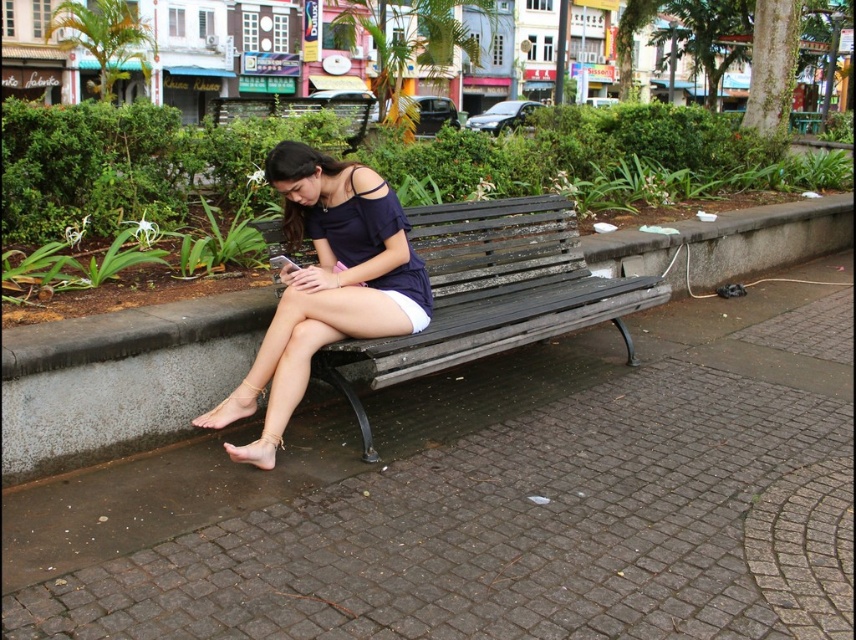
Question: Which point is closer to the camera taking this photo?

Choices:
 (A) (313, 269)
 (B) (522, 282)

Answer: (A)

Question: Is dark gray wooden bench at center behind matte blue dress at center?

Choices:
 (A) yes
 (B) no

Answer: (B)

Question: Is dark gray wooden bench at center positioned behind matte blue dress at center?

Choices:
 (A) yes
 (B) no

Answer: (B)

Question: Is dark gray wooden bench at center to the left of matte blue dress at center from the viewer's perspective?

Choices:
 (A) yes
 (B) no

Answer: (B)